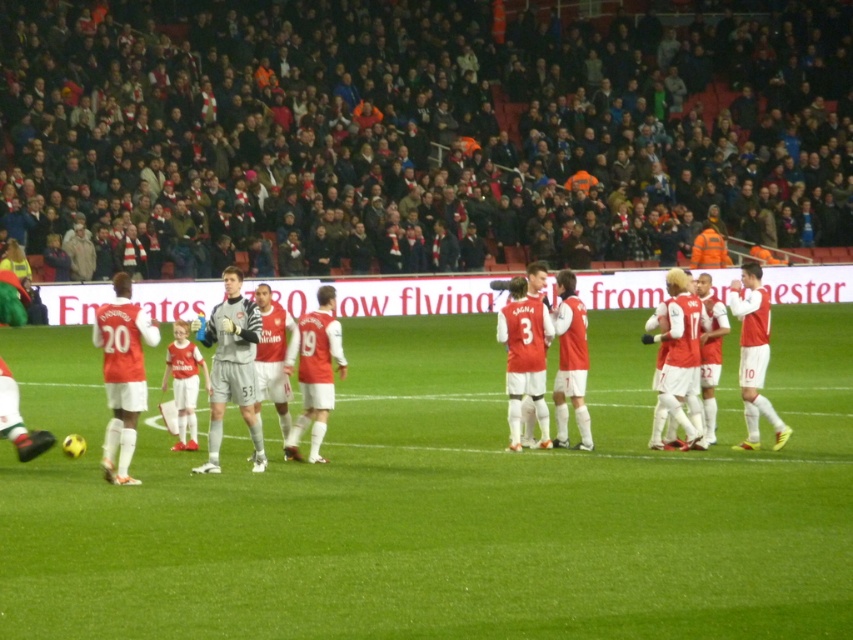
Does dark gray fabric crowd at upper center have a larger size compared to matte red jersey at right?

Yes, dark gray fabric crowd at upper center is bigger than matte red jersey at right.

Is point (782, 188) positioned behind point (733, 448)?

Yes, it is behind point (733, 448).

Locate an element on the screen. This screenshot has height=640, width=853. dark gray fabric crowd at upper center is located at coordinates (416, 132).

Is green grass football field at center above gray/white jersey at center?

No.

Image resolution: width=853 pixels, height=640 pixels. Identify the location of green grass football field at center. (440, 502).

Between point (602, 96) and point (253, 426), which one is positioned in front?

Point (253, 426)

Can you confirm if dark gray fabric crowd at upper center is bigger than gray/white jersey at center?

Correct, dark gray fabric crowd at upper center is larger in size than gray/white jersey at center.

Who is more distant from viewer, (184, 273) or (233, 355)?

Positioned behind is point (184, 273).

The width and height of the screenshot is (853, 640). What are the coordinates of `dark gray fabric crowd at upper center` in the screenshot? It's located at (416, 132).